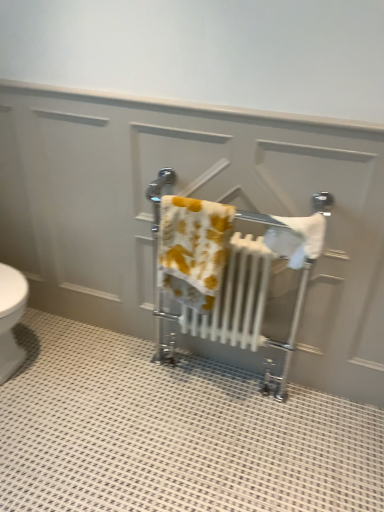
I want to click on space that is in front of white metallic towel rack at center, so click(x=220, y=442).